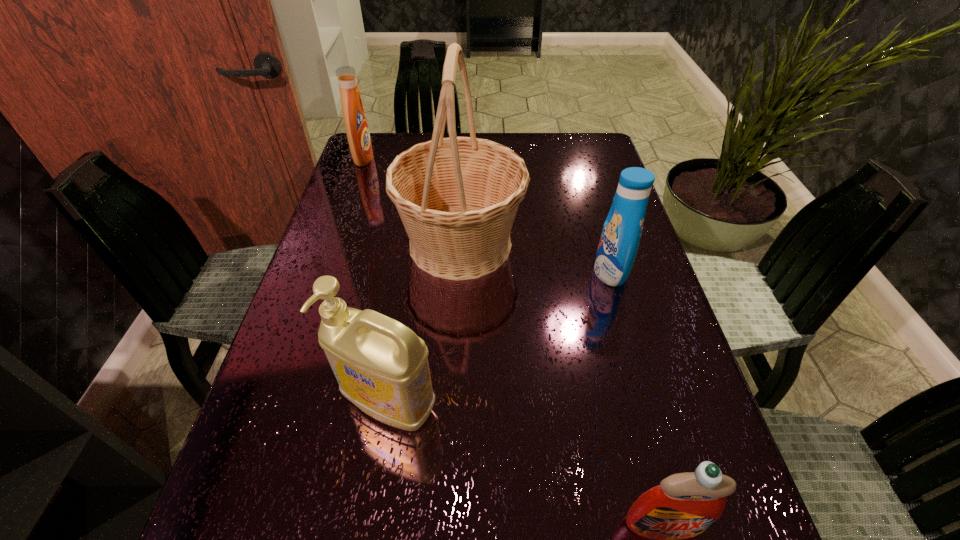
Find the location of a particular element. The image size is (960, 540). vacant space that satisfies the following two spatial constraints: 1. on the front-facing side of the basket; 2. on the left side of the farthest detergent is located at coordinates (334, 244).